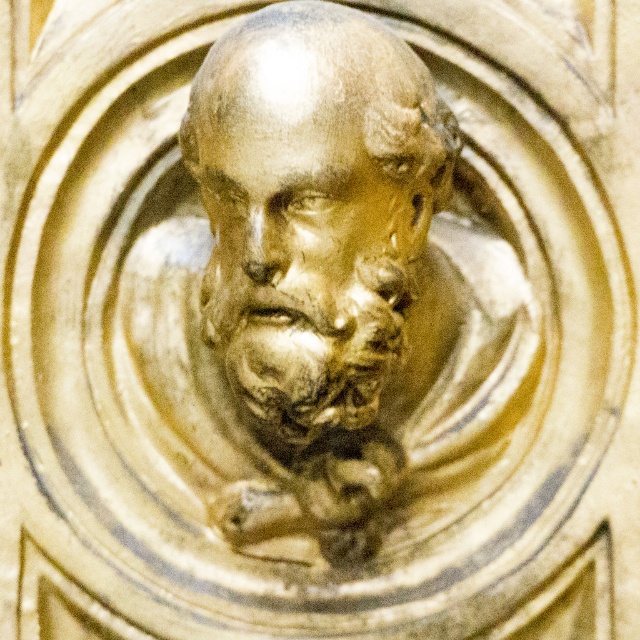
Based on the photo, you are a photographer standing 2 meters away from a gold textured bust at center. You want to take a closeup photo of it. Do you need to move closer or farther away?

The gold textured bust at center is 1.74 meters away from camera. Since you are currently 2 meters away, you need to move closer to achieve the desired closeup.

You are an art conservator assessing a sculpture. You notice the gold textured bust at center and the golden stone face at center. Which object is taller?

The gold textured bust at center is taller than the golden stone face at center according to the description.

You are an art conservator examining the sculpture. You notice two elements, the gold textured bust at center and the golden stone face at center. Which one is located to the right of the other?

The gold textured bust at center is positioned on the right side of golden stone face at center.